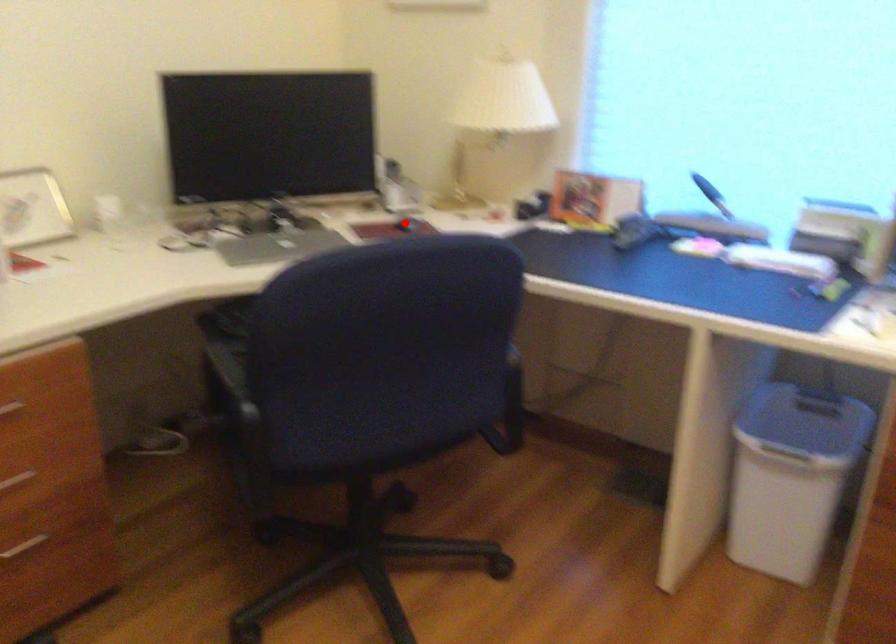
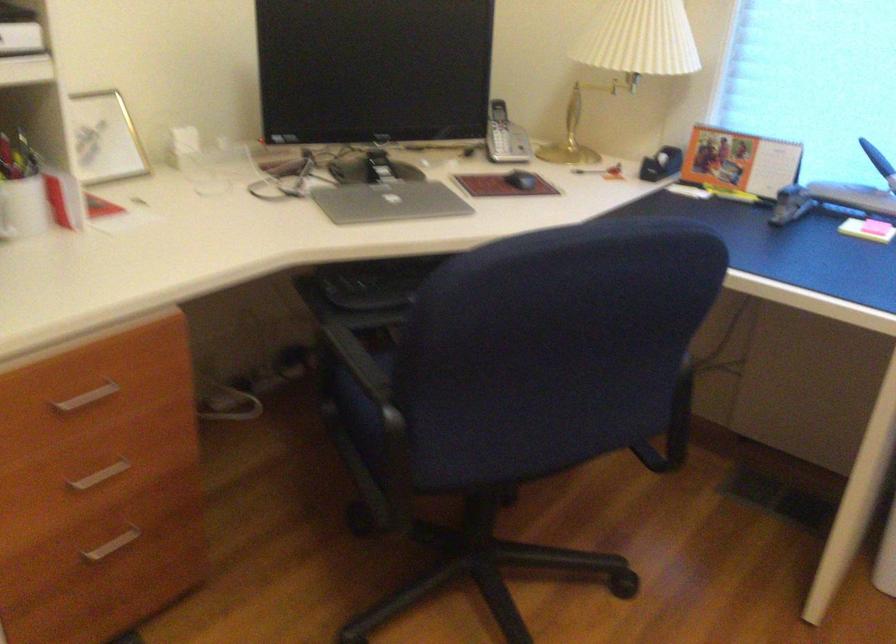
Question: I am providing you with two images of the same scene from different viewpoints. A red point is marked on the first image. At the location where the point appears in image 1, is it still visible in image 2?

Choices:
 (A) Yes
 (B) No

Answer: (A)